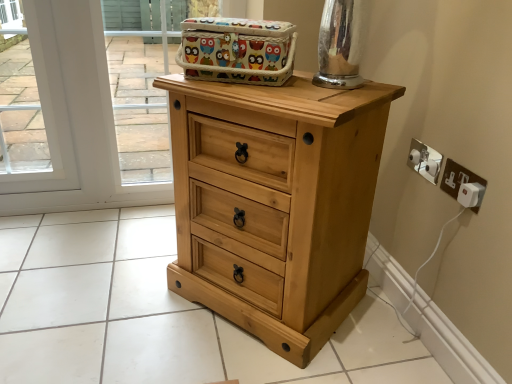
What do you see at coordinates (463, 185) in the screenshot?
I see `white plastic plug at lower right, marked as the second electric outlet in a back-to-front arrangement` at bounding box center [463, 185].

Consider the image. What is the approximate height of white plastic plug at lower right, the 1th electric outlet positioned from the front?

The height of white plastic plug at lower right, the 1th electric outlet positioned from the front, is 3.96 inches.

This screenshot has height=384, width=512. I want to click on natural wood chest of drawers at center, so click(275, 203).

Find the location of a particular element. white plastic electric outlet at right, which is the 2th electric outlet from front to back is located at coordinates (425, 160).

In order to click on white plastic plug at lower right, the 1th electric outlet positioned from the front in this screenshot , I will do [463, 185].

Which is behind, white plastic plug at lower right, marked as the second electric outlet in a back-to-front arrangement, or colorful fabric basket at upper center?

Positioned behind is colorful fabric basket at upper center.

Consider the image. Between white plastic plug at lower right, marked as the second electric outlet in a back-to-front arrangement, and colorful fabric basket at upper center, which one has smaller width?

With smaller width is white plastic plug at lower right, marked as the second electric outlet in a back-to-front arrangement.

Who is bigger, white plastic plug at lower right, the 1th electric outlet positioned from the front, or colorful fabric basket at upper center?

colorful fabric basket at upper center.

Does point (460, 185) appear closer or farther from the camera than point (267, 37)?

Point (460, 185) is positioned farther from the camera compared to point (267, 37).

Which is in front, colorful fabric basket at upper center or natural wood chest of drawers at center?

natural wood chest of drawers at center is in front.

Considering the points (286, 66) and (175, 178), which point is in front, point (286, 66) or point (175, 178)?

The point (286, 66) is closer to the camera.

Is colorful fabric basket at upper center positioned beyond the bounds of natural wood chest of drawers at center?

colorful fabric basket at upper center is positioned outside natural wood chest of drawers at center.

From a real-world perspective, is colorful fabric basket at upper center under natural wood chest of drawers at center?

No, from a real-world perspective, colorful fabric basket at upper center is not below natural wood chest of drawers at center.

Is white plastic plug at lower right, the 1th electric outlet positioned from the front, not near white plastic electric outlet at right, which is the 2th electric outlet from front to back?

They are positioned close to each other.

Who is shorter, white plastic plug at lower right, the 1th electric outlet positioned from the front, or white plastic electric outlet at right, which is the 2th electric outlet from front to back?

Standing shorter between the two is white plastic electric outlet at right, which is the 2th electric outlet from front to back.

Is white plastic plug at lower right, marked as the second electric outlet in a back-to-front arrangement, wider than white plastic electric outlet at right, which is the 2th electric outlet from front to back?

In fact, white plastic plug at lower right, marked as the second electric outlet in a back-to-front arrangement, might be narrower than white plastic electric outlet at right, which is the 2th electric outlet from front to back.

Locate an element on the screen. This screenshot has height=384, width=512. electric outlet behind the white plastic plug at lower right, marked as the second electric outlet in a back-to-front arrangement is located at coordinates (425, 160).

From a real-world perspective, between wooden basket at upper center and natural wood chest of drawers at center, who is vertically higher?

wooden basket at upper center, from a real-world perspective.

Who is more distant, wooden basket at upper center or natural wood chest of drawers at center?

Positioned behind is wooden basket at upper center.

Based on the photo, does wooden basket at upper center contain natural wood chest of drawers at center?

No, natural wood chest of drawers at center is located outside of wooden basket at upper center.

Considering the relative positions of white plastic electric outlet at right, positioned as the 1th electric outlet in back-to-front order, and wooden basket at upper center in the image provided, is white plastic electric outlet at right, positioned as the 1th electric outlet in back-to-front order, to the left of wooden basket at upper center from the viewer's perspective?

No.

Where is `the 1st electric outlet in front when counting from the wooden basket at upper center`? the 1st electric outlet in front when counting from the wooden basket at upper center is located at coordinates (425, 160).

From their relative heights in the image, would you say white plastic electric outlet at right, which is the 2th electric outlet from front to back, is taller or shorter than wooden basket at upper center?

white plastic electric outlet at right, which is the 2th electric outlet from front to back, is shorter than wooden basket at upper center.

From the picture: Is colorful fabric basket at upper center positioned beyond the bounds of white plastic electric outlet at right, which is the 2th electric outlet from front to back?

Yes, colorful fabric basket at upper center is located beyond the bounds of white plastic electric outlet at right, which is the 2th electric outlet from front to back.

Measure the distance from colorful fabric basket at upper center to white plastic electric outlet at right, which is the 2th electric outlet from front to back.

They are 21.39 inches apart.

Are colorful fabric basket at upper center and white plastic electric outlet at right, which is the 2th electric outlet from front to back, beside each other?

colorful fabric basket at upper center and white plastic electric outlet at right, which is the 2th electric outlet from front to back, are not in contact.

From the image's perspective, which is below, colorful fabric basket at upper center or white plastic electric outlet at right, which is the 2th electric outlet from front to back?

From the image's view, white plastic electric outlet at right, which is the 2th electric outlet from front to back, is below.

In the image, is white plastic electric outlet at right, which is the 2th electric outlet from front to back, on the left side or the right side of white plastic plug at lower right, the 1th electric outlet positioned from the front?

white plastic electric outlet at right, which is the 2th electric outlet from front to back, is positioned on white plastic plug at lower right, the 1th electric outlet positioned from the front,'s left side.

How many degrees apart are the facing directions of white plastic electric outlet at right, which is the 2th electric outlet from front to back, and white plastic plug at lower right, marked as the second electric outlet in a back-to-front arrangement?

0.0352 degrees separate the facing orientations of white plastic electric outlet at right, which is the 2th electric outlet from front to back, and white plastic plug at lower right, marked as the second electric outlet in a back-to-front arrangement.

From the image's perspective, between white plastic electric outlet at right, which is the 2th electric outlet from front to back, and white plastic plug at lower right, marked as the second electric outlet in a back-to-front arrangement, who is located below?

From the image's view, white plastic plug at lower right, marked as the second electric outlet in a back-to-front arrangement, is below.

Is white plastic electric outlet at right, which is the 2th electric outlet from front to back, smaller than white plastic plug at lower right, marked as the second electric outlet in a back-to-front arrangement?

Incorrect, white plastic electric outlet at right, which is the 2th electric outlet from front to back, is not smaller in size than white plastic plug at lower right, marked as the second electric outlet in a back-to-front arrangement.

Where is `the 2nd electric outlet positioned below the colorful fabric basket at upper center (from a real-world perspective)`? the 2nd electric outlet positioned below the colorful fabric basket at upper center (from a real-world perspective) is located at coordinates (463, 185).

In order to click on crate behind the natural wood chest of drawers at center in this screenshot , I will do `click(237, 50)`.

Looking at this image, considering their positions, is white plastic electric outlet at right, positioned as the 1th electric outlet in back-to-front order, positioned further to wooden basket at upper center than white plastic plug at lower right, the 1th electric outlet positioned from the front?

white plastic plug at lower right, the 1th electric outlet positioned from the front.

Considering their positions, is wooden basket at upper center positioned further to white plastic electric outlet at right, positioned as the 1th electric outlet in back-to-front order, than colorful fabric basket at upper center?

Among the two, wooden basket at upper center is located further to white plastic electric outlet at right, positioned as the 1th electric outlet in back-to-front order.

Looking at this image, based on their spatial positions, is white plastic electric outlet at right, positioned as the 1th electric outlet in back-to-front order, or natural wood chest of drawers at center further from wooden basket at upper center?

white plastic electric outlet at right, positioned as the 1th electric outlet in back-to-front order, is further to wooden basket at upper center.

Estimate the real-world distances between objects in this image. Which object is closer to white plastic plug at lower right, the 1th electric outlet positioned from the front, colorful fabric basket at upper center or wooden basket at upper center?

colorful fabric basket at upper center is positioned closer to the anchor white plastic plug at lower right, the 1th electric outlet positioned from the front.

Based on their spatial positions, is white plastic plug at lower right, the 1th electric outlet positioned from the front, or wooden basket at upper center closer to colorful fabric basket at upper center?

Based on the image, white plastic plug at lower right, the 1th electric outlet positioned from the front, appears to be nearer to colorful fabric basket at upper center.

From the image, which object appears to be nearer to white plastic electric outlet at right, positioned as the 1th electric outlet in back-to-front order, colorful fabric basket at upper center or natural wood chest of drawers at center?

Based on the image, natural wood chest of drawers at center appears to be nearer to white plastic electric outlet at right, positioned as the 1th electric outlet in back-to-front order.

Estimate the real-world distances between objects in this image. Which object is closer to natural wood chest of drawers at center, white plastic electric outlet at right, which is the 2th electric outlet from front to back, or wooden basket at upper center?

Based on the image, white plastic electric outlet at right, which is the 2th electric outlet from front to back, appears to be nearer to natural wood chest of drawers at center.

Consider the image. Which object lies further to the anchor point natural wood chest of drawers at center, wooden basket at upper center or white plastic electric outlet at right, positioned as the 1th electric outlet in back-to-front order?

wooden basket at upper center is positioned further to the anchor natural wood chest of drawers at center.

Locate an element on the screen. The width and height of the screenshot is (512, 384). the chest of drawers situated between wooden basket at upper center and white plastic plug at lower right, the 1th electric outlet positioned from the front, from left to right is located at coordinates [x=275, y=203].

You are a GUI agent. You are given a task and a screenshot of the screen. Output one action in this format:
    pyautogui.click(x=<x>, y=<y>)
    Task: Click on the crate situated between wooden basket at upper center and white plastic electric outlet at right, which is the 2th electric outlet from front to back, from left to right
    
    Given the screenshot: What is the action you would take?
    pyautogui.click(x=237, y=50)

I want to click on the chest of drawers located between colorful fabric basket at upper center and white plastic electric outlet at right, which is the 2th electric outlet from front to back, in the left-right direction, so (275, 203).

The image size is (512, 384). What are the coordinates of `electric outlet between wooden basket at upper center and white plastic plug at lower right, marked as the second electric outlet in a back-to-front arrangement, in the horizontal direction` in the screenshot? It's located at (425, 160).